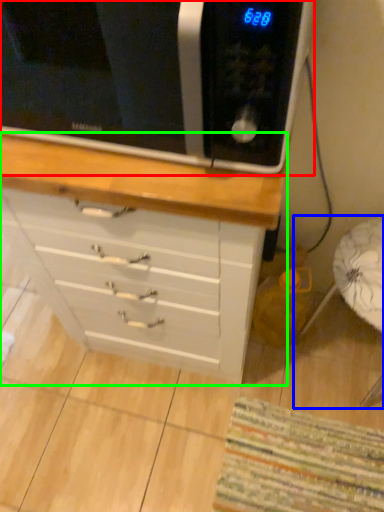
Question: Which is nearer to the microwave oven (highlighted by a red box)? swivel chair (highlighted by a blue box) or chest of drawers (highlighted by a green box).

Choices:
 (A) swivel chair
 (B) chest of drawers

Answer: (B)